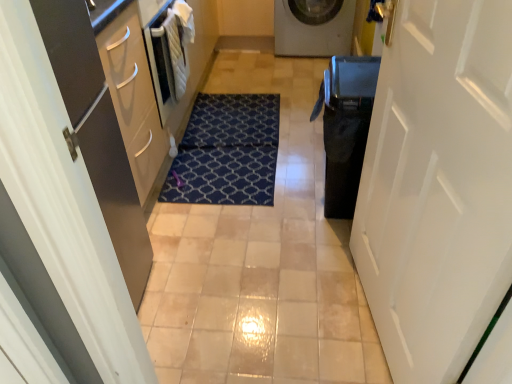
Locate an element on the screen. The height and width of the screenshot is (384, 512). free space to the left of white matte door at right, which ranks as the second door in left-to-right order is located at coordinates (285, 307).